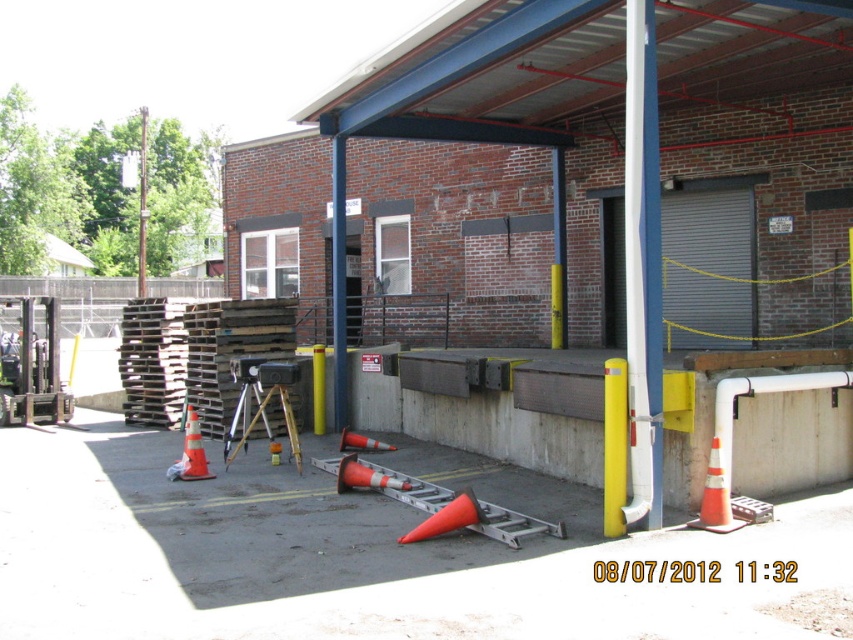
Does yellow matte pole at center appear under orange reflective cone at lower right?

Incorrect, yellow matte pole at center is not positioned below orange reflective cone at lower right.

Does yellow matte pole at center come in front of orange reflective cone at lower right?

Yes, yellow matte pole at center is in front of orange reflective cone at lower right.

Is point (639, 173) farther from camera compared to point (709, 456)?

That is False.

Locate an element on the screen. Image resolution: width=853 pixels, height=640 pixels. yellow matte pole at center is located at coordinates (642, 266).

Is point (343, 205) farther from camera compared to point (142, 260)?

That is False.

Does yellow/yellowish metal pole at center appear on the left side of brushed metal pole at upper center?

No, yellow/yellowish metal pole at center is not to the left of brushed metal pole at upper center.

Is point (341, 371) positioned before point (140, 125)?

That is True.

Where is `yellow/yellowish metal pole at center`? yellow/yellowish metal pole at center is located at coordinates pos(338,282).

This screenshot has width=853, height=640. Identify the location of yellow/yellowish metal pole at center. (338, 282).

What do you see at coordinates (338, 282) in the screenshot?
I see `yellow/yellowish metal pole at center` at bounding box center [338, 282].

The width and height of the screenshot is (853, 640). What do you see at coordinates (338, 282) in the screenshot?
I see `yellow/yellowish metal pole at center` at bounding box center [338, 282].

The image size is (853, 640). I want to click on yellow/yellowish metal pole at center, so click(x=338, y=282).